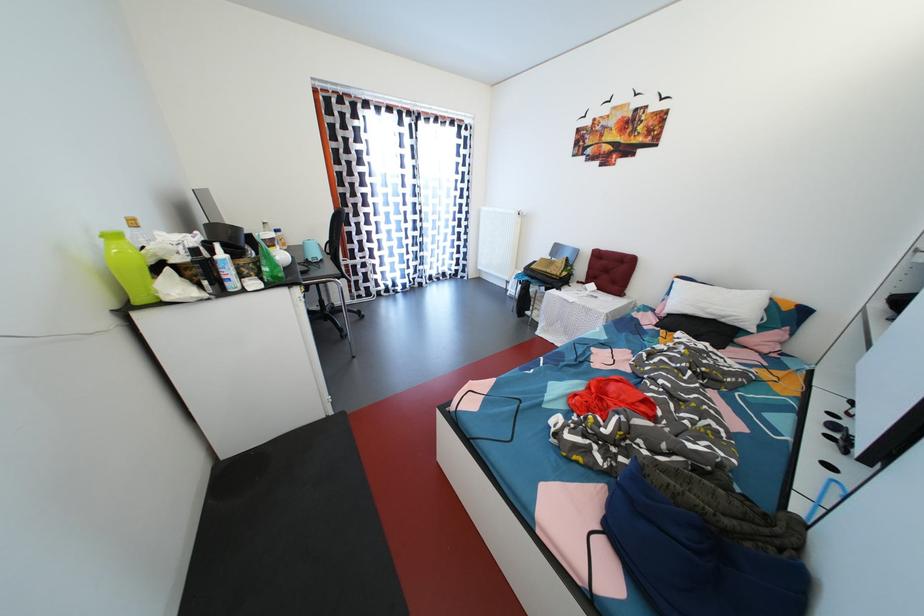
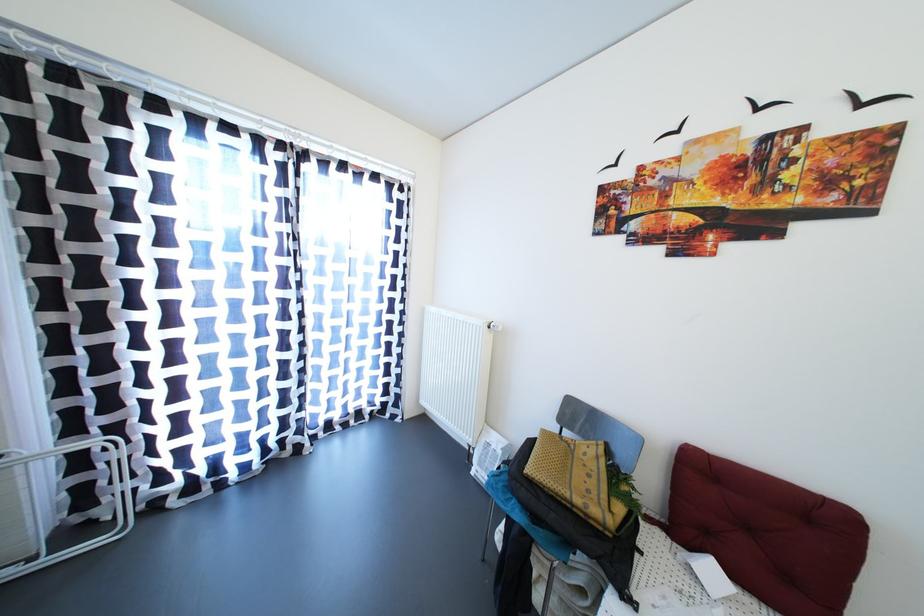
Question: The images are taken continuously from a first-person perspective. In which direction are you moving?

Choices:
 (A) Left
 (B) Right
 (C) Forward
 (D) Backward

Answer: (C)